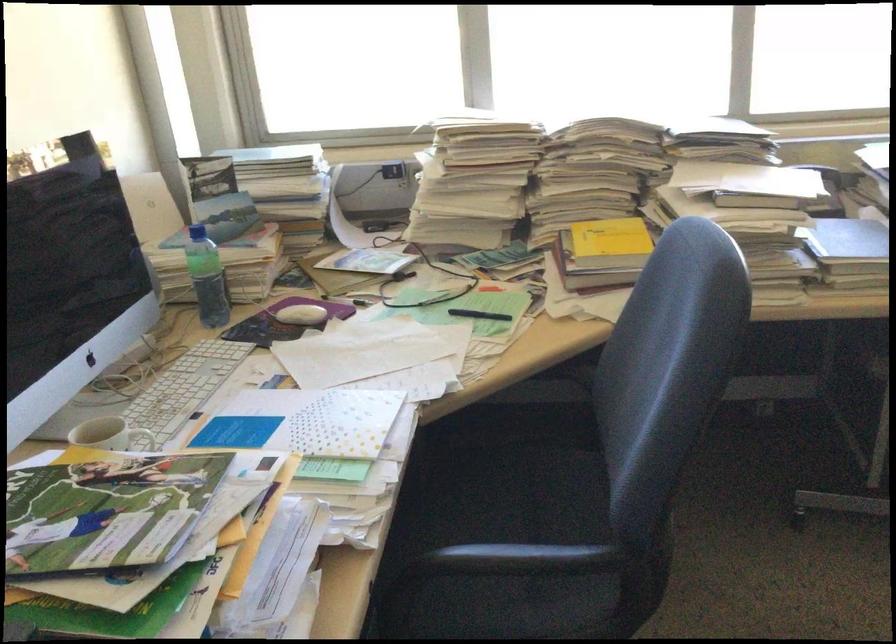
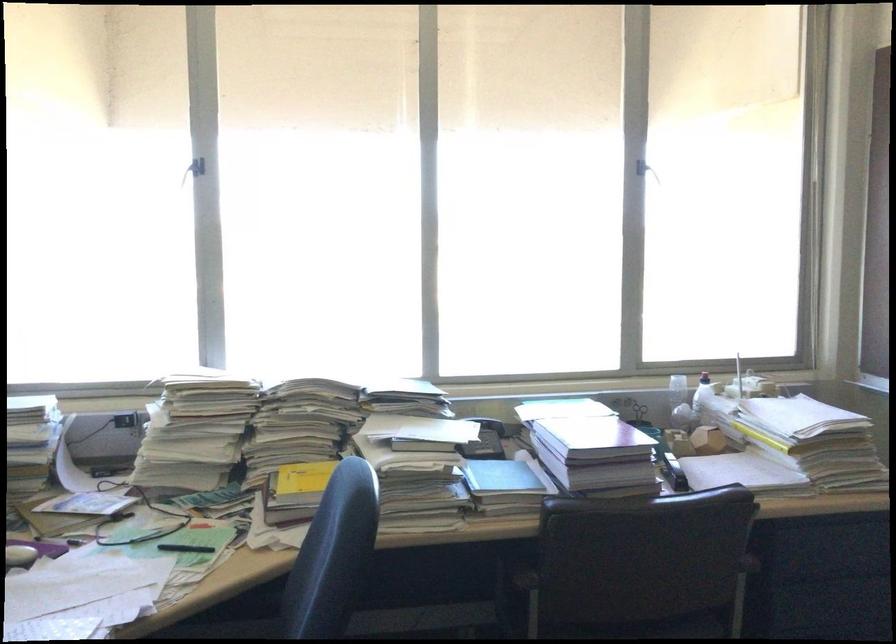
Question: What movement of the cameraman would produce the second image?

Choices:
 (A) Left
 (B) Right
 (C) Forward
 (D) Backward

Answer: (D)